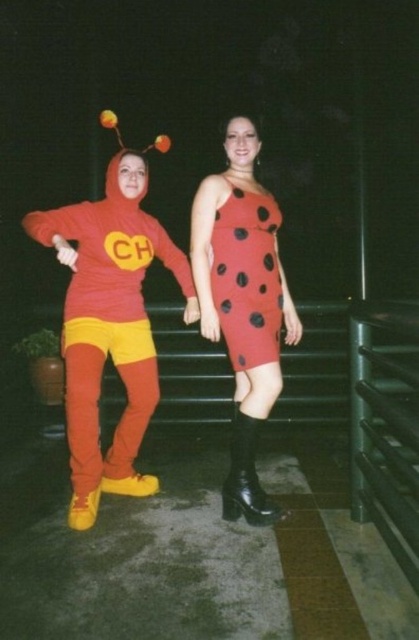
Question: Does matte red dress with black polka dots at center come in front of red dotted dress at center?

Choices:
 (A) yes
 (B) no

Answer: (A)

Question: Among these points, which one is farthest from the camera?

Choices:
 (A) (206, 216)
 (B) (292, 308)

Answer: (B)

Question: Which object is the farthest from the matte red dress with black polka dots at center?

Choices:
 (A) red dotted dress at center
 (B) black leather boot at lower center

Answer: (B)

Question: Which point is closer to the camera?

Choices:
 (A) black leather boot at lower center
 (B) matte red costume at left
 (C) red dotted dress at center
 (D) matte red dress with black polka dots at center

Answer: (B)

Question: Can you confirm if matte red costume at left is thinner than black leather boot at lower center?

Choices:
 (A) no
 (B) yes

Answer: (A)

Question: Is matte red costume at left smaller than red dotted dress at center?

Choices:
 (A) no
 (B) yes

Answer: (A)